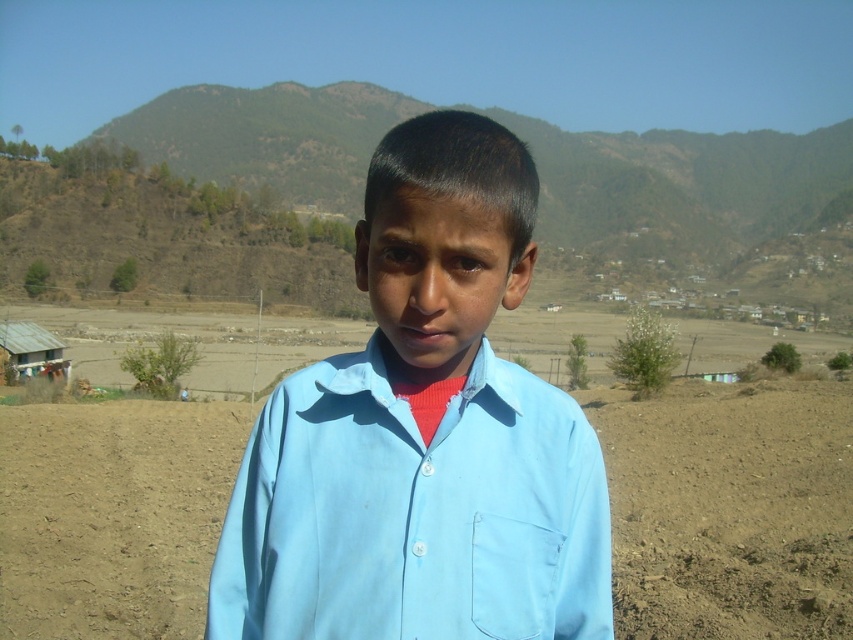
You are a photographer trying to capture the boy in the scene. Since the light blue cotton shirt at center and brown soil at center are both in the frame, which one appears narrower?

The light blue cotton shirt at center appears narrower than the brown soil at center because it has a lesser width compared to the brown soil at center.